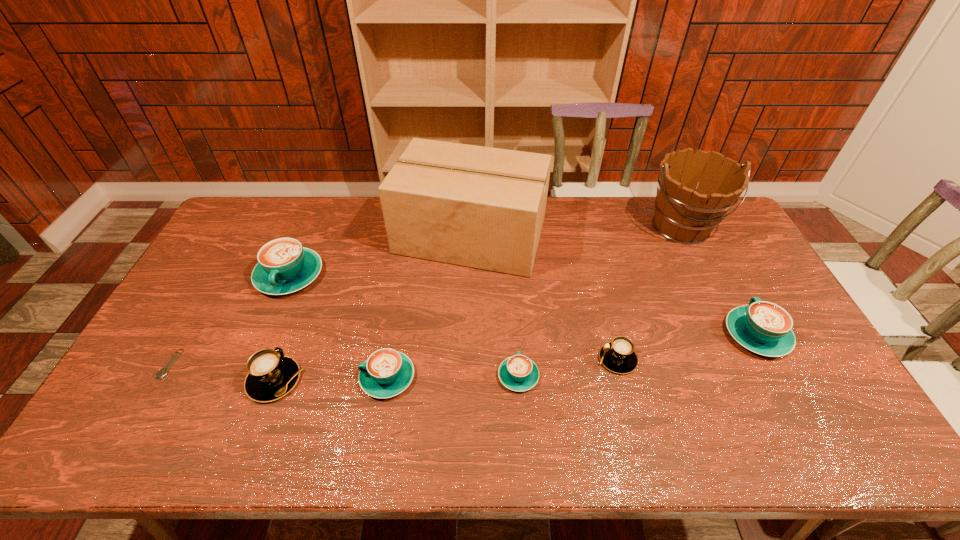
The width and height of the screenshot is (960, 540). Identify the location of the third object from right to left. (618, 356).

Identify the location of the second shortest object. The image size is (960, 540). (518, 373).

Identify the location of the shortest cappuccino. (518, 373).

Find the location of a particular element. the leftmost object is located at coordinates (163, 372).

Identify the location of watch. This screenshot has height=540, width=960. (163, 372).

In order to click on vacant area situated on the left of the box in this screenshot , I will do `click(295, 236)`.

Where is `vacant space located 0.310m with the handle on the wine bucket`? The image size is (960, 540). vacant space located 0.310m with the handle on the wine bucket is located at coordinates (729, 325).

Identify the location of vacant space located 0.060m with the handle on the right side of the leftmost turquoise cappuccino. (273, 316).

Locate an element on the screen. vacant space positioned 0.080m with the handle on the right side of the second biggest turquoise cappuccino is located at coordinates (732, 291).

Image resolution: width=960 pixels, height=540 pixels. What are the coordinates of `free location located 0.120m with the handle on the right side of the second biggest turquoise cappuccino` in the screenshot? It's located at (728, 282).